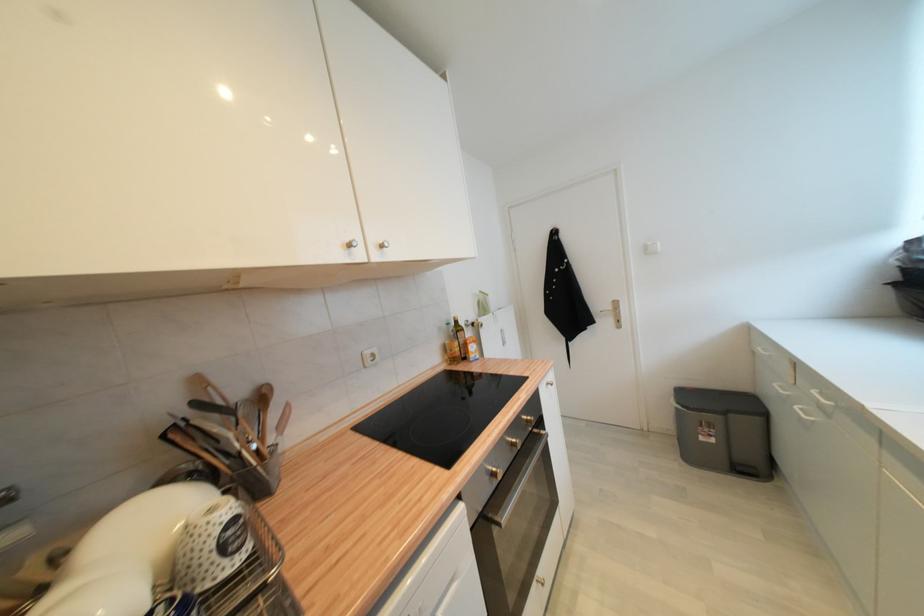
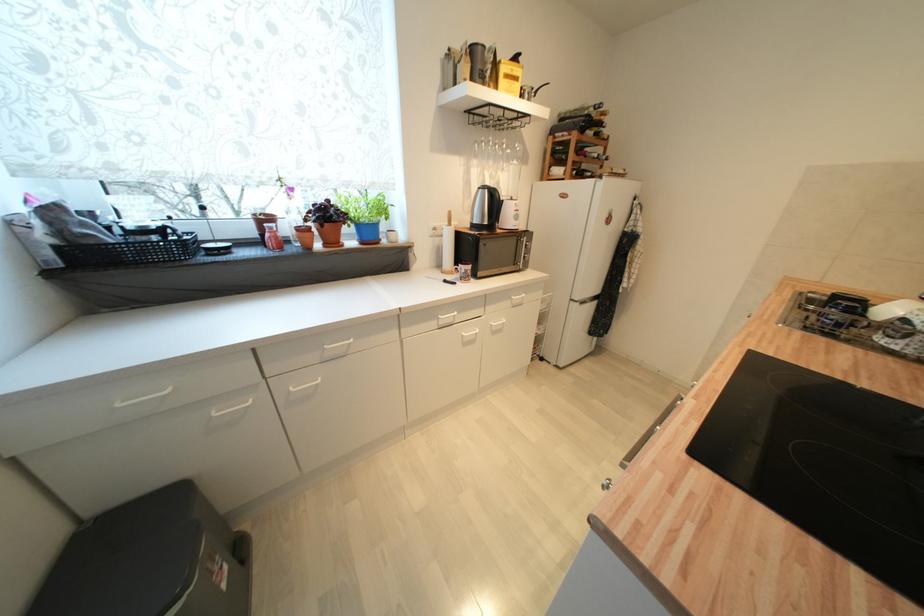
Find the pixel in the second image that matches point 707,440 in the first image.

(228, 588)